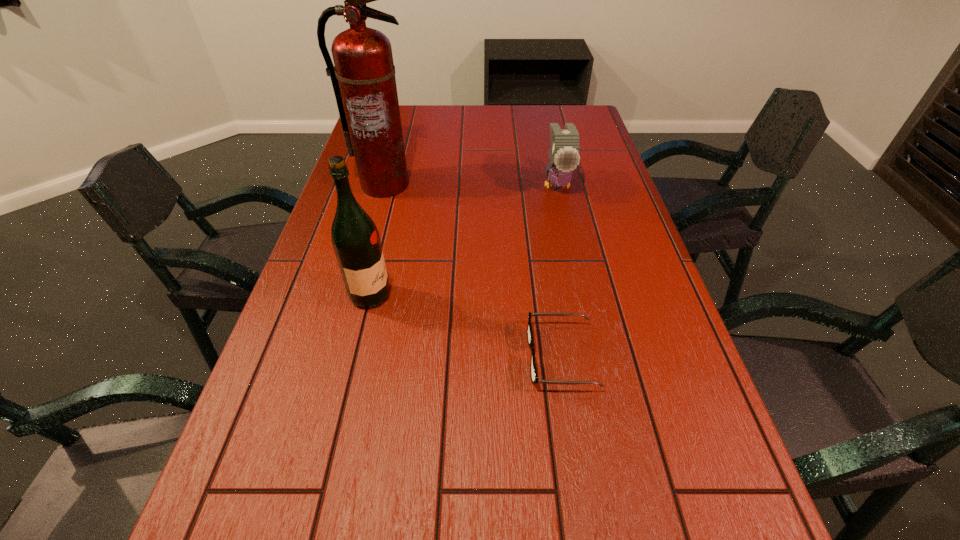
The width and height of the screenshot is (960, 540). In order to click on free space that satisfies the following two spatial constraints: 1. at the beak of the bird; 2. on the front-facing side of the shortest object in this screenshot , I will do click(595, 356).

Where is `free space in the image that satisfies the following two spatial constraints: 1. at the beak of the third tallest object; 2. on the front-facing side of the shortest object`? This screenshot has width=960, height=540. free space in the image that satisfies the following two spatial constraints: 1. at the beak of the third tallest object; 2. on the front-facing side of the shortest object is located at coordinates (595, 356).